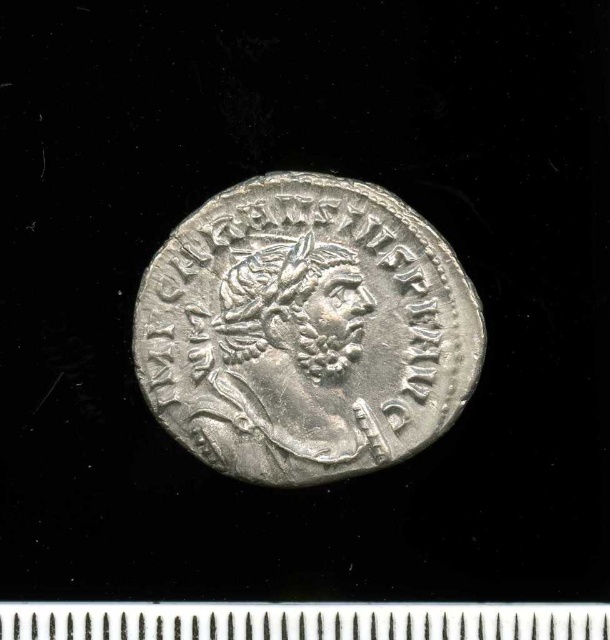
Question: Does silver metallic coin at center lie behind metallic ruler at bottom?

Choices:
 (A) yes
 (B) no

Answer: (A)

Question: Which point is farther to the camera?

Choices:
 (A) silver metallic coin at center
 (B) metallic ruler at bottom

Answer: (A)

Question: Is silver metallic coin at center to the right of metallic ruler at bottom from the viewer's perspective?

Choices:
 (A) no
 (B) yes

Answer: (B)

Question: Among these points, which one is farthest from the camera?

Choices:
 (A) (325, 216)
 (B) (239, 605)

Answer: (A)

Question: Is silver metallic coin at center wider than metallic ruler at bottom?

Choices:
 (A) no
 (B) yes

Answer: (A)